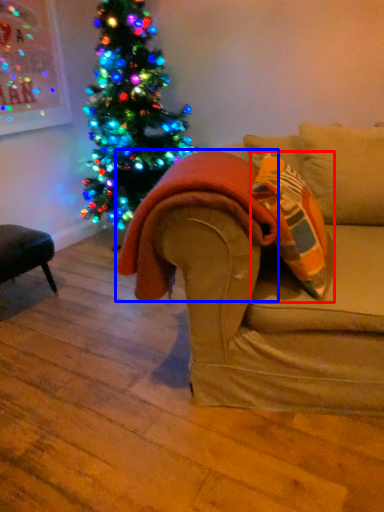
Question: Which object appears farthest to the camera in this image, throw pillow (highlighted by a red box) or blanket (highlighted by a blue box)?

Choices:
 (A) throw pillow
 (B) blanket

Answer: (B)